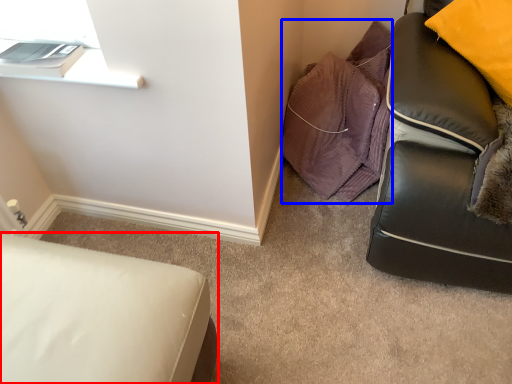
Question: Which point is closer to the camera, furniture (highlighted by a red box) or material (highlighted by a blue box)?

Choices:
 (A) furniture
 (B) material

Answer: (A)